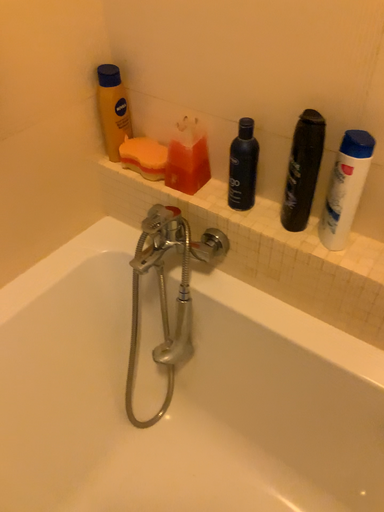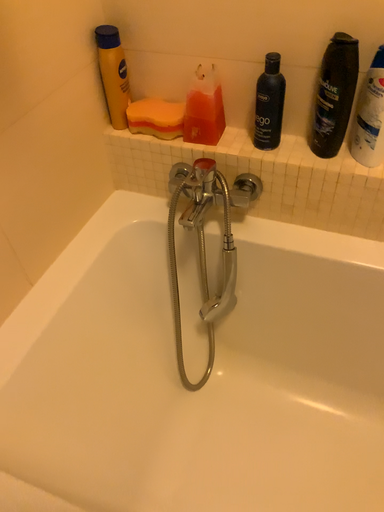
Question: How did the camera likely rotate when shooting the video?

Choices:
 (A) rotated left
 (B) rotated right

Answer: (B)